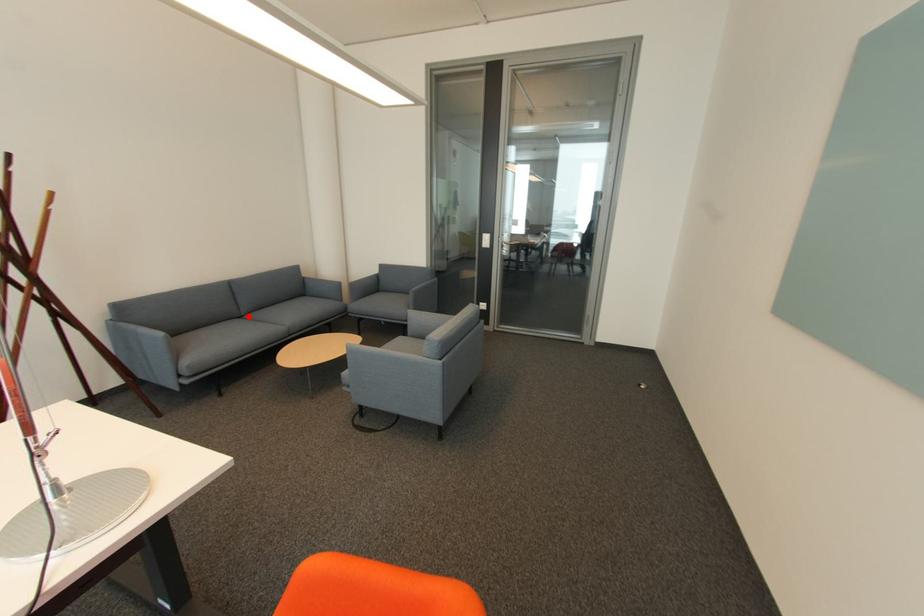
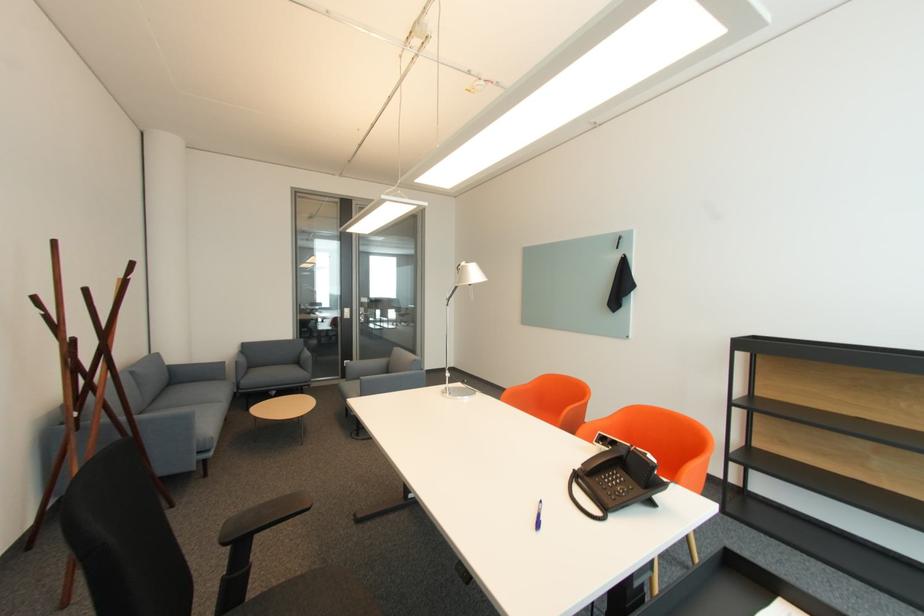
Question: I am providing you with two images of the same scene from different viewpoints. Given a red point in image1, look at the same physical point in image2. Is it:

Choices:
 (A) Closer to the viewpoint
 (B) Farther from the viewpoint

Answer: (B)